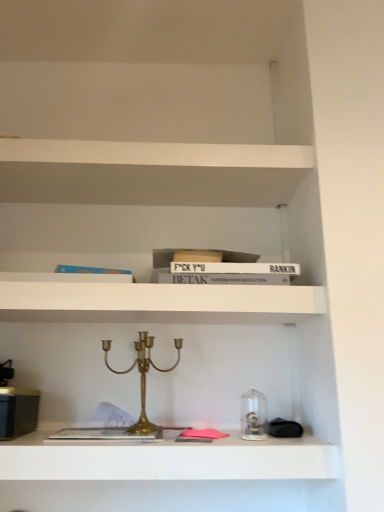
Question: Can you confirm if white matte bookshelf at upper center, arranged as the 1th shelf when viewed from the top, is bigger than gold brass candle holder at center?

Choices:
 (A) yes
 (B) no

Answer: (A)

Question: Is white matte bookshelf at upper center, arranged as the 1th shelf when viewed from the top, smaller than gold brass candle holder at center?

Choices:
 (A) yes
 (B) no

Answer: (B)

Question: Is white matte bookshelf at upper center, arranged as the 1th shelf when viewed from the top, at the right side of gold brass candle holder at center?

Choices:
 (A) no
 (B) yes

Answer: (A)

Question: From a real-world perspective, is white matte bookshelf at upper center, which appears as the 2th shelf when ordered from the bottom, beneath gold brass candle holder at center?

Choices:
 (A) yes
 (B) no

Answer: (B)

Question: From the image's perspective, is white matte bookshelf at upper center, arranged as the 1th shelf when viewed from the top, located above gold brass candle holder at center?

Choices:
 (A) yes
 (B) no

Answer: (A)

Question: In terms of width, does metallic gold candelabra at center, which is counted as the second shelf, starting from the top, look wider or thinner when compared to gold brass candle holder at center?

Choices:
 (A) wide
 (B) thin

Answer: (A)

Question: Considering the relative positions of metallic gold candelabra at center, the 1th shelf ordered from the bottom, and gold brass candle holder at center in the image provided, is metallic gold candelabra at center, the 1th shelf ordered from the bottom, to the left or to the right of gold brass candle holder at center?

Choices:
 (A) right
 (B) left

Answer: (A)

Question: Is point (327, 449) closer or farther from the camera than point (175, 361)?

Choices:
 (A) closer
 (B) farther

Answer: (A)

Question: In terms of size, does metallic gold candelabra at center, the 1th shelf ordered from the bottom, appear bigger or smaller than gold brass candle holder at center?

Choices:
 (A) big
 (B) small

Answer: (A)

Question: Is gold brass candle holder at center inside the boundaries of metallic gold candelabra at center, which is counted as the second shelf, starting from the top, or outside?

Choices:
 (A) inside
 (B) outside

Answer: (B)

Question: From the image's perspective, is gold brass candle holder at center located above or below metallic gold candelabra at center, the 1th shelf ordered from the bottom?

Choices:
 (A) above
 (B) below

Answer: (A)

Question: Is point (144, 382) positioned closer to the camera than point (74, 464)?

Choices:
 (A) farther
 (B) closer

Answer: (A)

Question: Considering their positions, is gold brass candle holder at center located in front of or behind metallic gold candelabra at center, the 1th shelf ordered from the bottom?

Choices:
 (A) front
 (B) behind

Answer: (B)

Question: Based on their sizes in the image, would you say white matte bookshelf at upper center, which appears as the 2th shelf when ordered from the bottom, is bigger or smaller than gold brass candle holder at center?

Choices:
 (A) small
 (B) big

Answer: (B)

Question: Is white matte bookshelf at upper center, which appears as the 2th shelf when ordered from the bottom, wider or thinner than gold brass candle holder at center?

Choices:
 (A) thin
 (B) wide

Answer: (B)